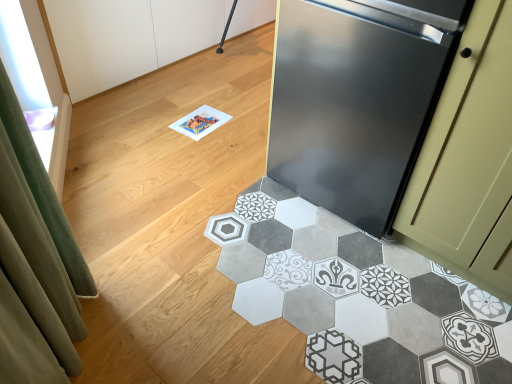
This screenshot has height=384, width=512. Find the location of `free space on the front side of stainless steel refrigerator at right`. free space on the front side of stainless steel refrigerator at right is located at coordinates (361, 312).